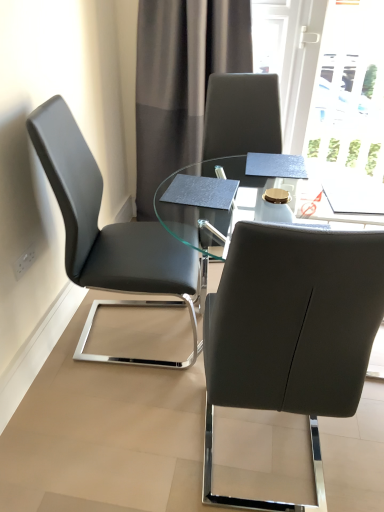
Find the location of a particular element. Image resolution: width=384 pixels, height=512 pixels. vacant region below matte black chair at left, which appears as the 1th chair when viewed from the left (from a real-world perspective) is located at coordinates (131, 333).